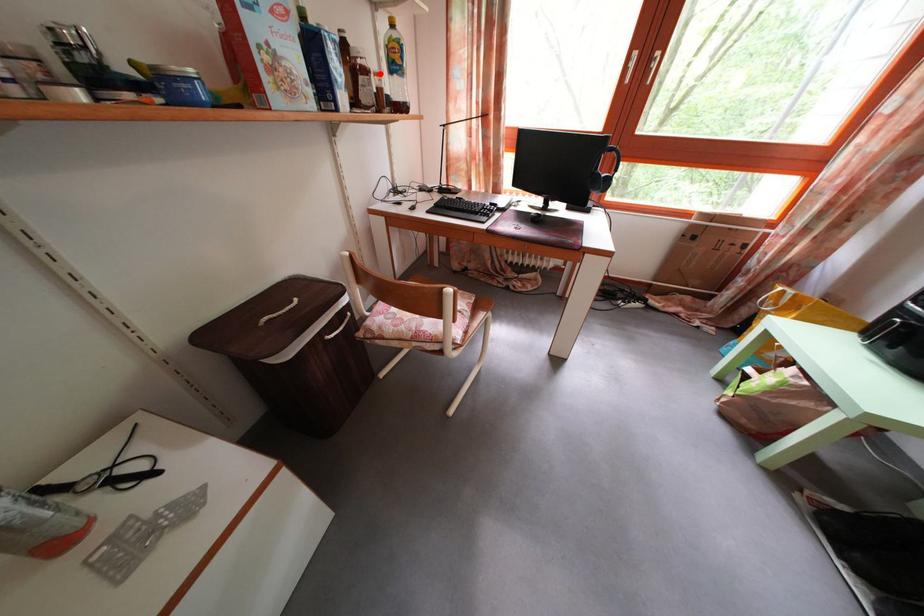
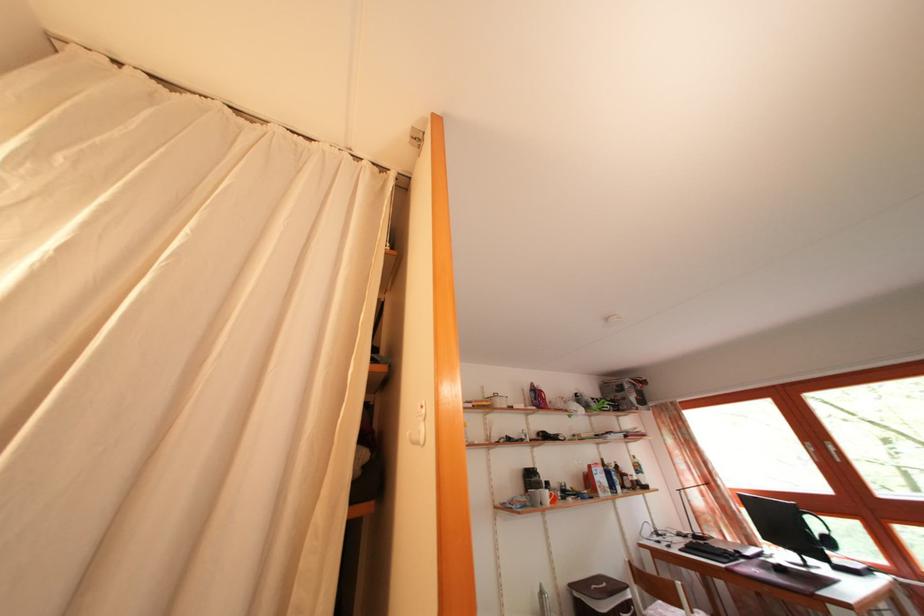
Question: I am providing you with two images of the same scene from different viewpoints. A red point is shown in image1. For the corresponding object point in image2, is it positioned nearer or farther from the camera?

Choices:
 (A) Nearer
 (B) Farther

Answer: (B)